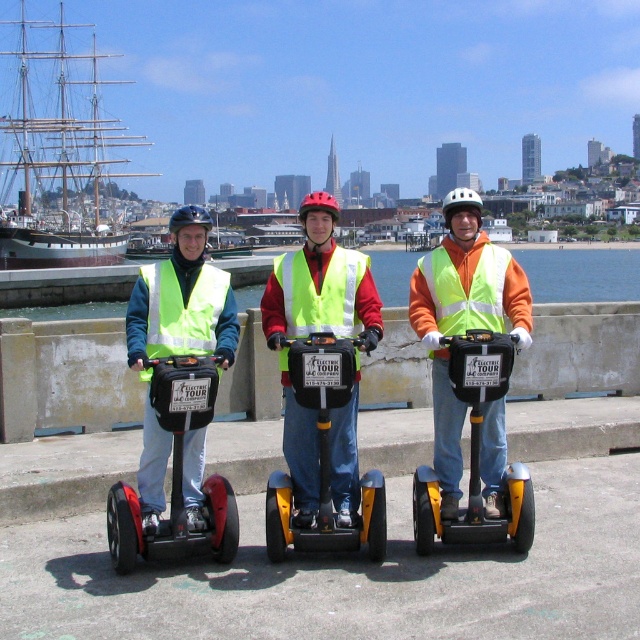
You are a photographer positioned at the front of the scene. You want to take a photo of the white wooden ship at upper left without any obstructions. Are you able to capture it clearly without the matte yellow vest at center appearing in the frame?

The matte yellow vest at center is behind the white wooden ship at upper left, so the ship will block the vest from view. Therefore, you can take a clear photo of the white wooden ship at upper left without the matte yellow vest at center obstructing the shot.

You are a tour guide planning a route for a Segway tour along the waterfront. You need to ensure that the yellow matte Segway at center can pass under a low bridge ahead. The blue water at center is 2 meters deep. What information do you need to determine if the Segway can safely pass under the bridge?

To determine if the yellow matte Segway at center can pass under the bridge, you need to know the height of the bridge and the height of the Segway. The blue water at center depth is irrelevant to this calculation.